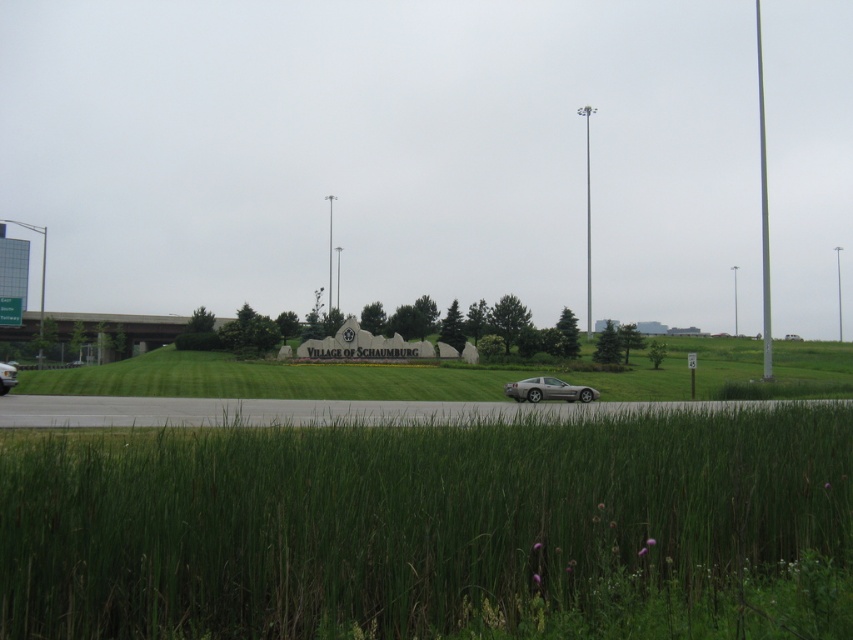
Can you confirm if silver metallic car at center is positioned below silver metallic car at lower left?

Yes, silver metallic car at center is below silver metallic car at lower left.

Who is positioned more to the left, silver metallic car at center or silver metallic car at lower left?

From the viewer's perspective, silver metallic car at lower left appears more on the left side.

Is point (543, 397) more distant than point (12, 364)?

No, it is not.

Where is `silver metallic car at center`? The height and width of the screenshot is (640, 853). silver metallic car at center is located at coordinates (548, 390).

The image size is (853, 640). In order to click on green grass at lower center in this screenshot , I will do `click(422, 524)`.

In the scene shown: Can you confirm if green grass at lower center is positioned above silver metallic car at center?

Indeed, green grass at lower center is positioned over silver metallic car at center.

This screenshot has width=853, height=640. Identify the location of green grass at lower center. (422, 524).

Image resolution: width=853 pixels, height=640 pixels. In order to click on green grass at center in this screenshot , I will do `click(462, 376)`.